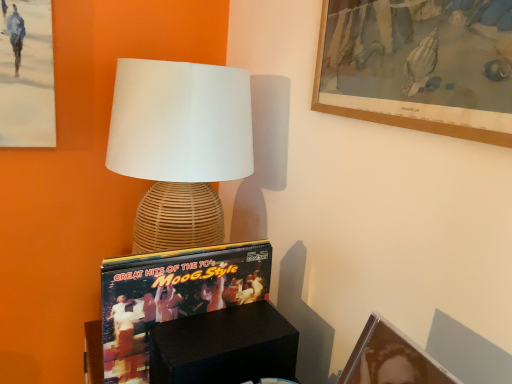
What do you see at coordinates (419, 65) in the screenshot?
I see `wooden picture frame at upper right, the 1th picture frame viewed from the top` at bounding box center [419, 65].

The height and width of the screenshot is (384, 512). I want to click on wooden picture frame at upper right, the 1th picture frame viewed from the top, so click(419, 65).

How much space does matte black picture frame at lower right, the second picture frame in the top-to-bottom sequence, occupy vertically?

5.65 inches.

At what (x,y) coordinates should I click in order to perform the action: click on black matte box at lower center. Please return your answer as a coordinate pair (x, y). The width and height of the screenshot is (512, 384). Looking at the image, I should click on (224, 347).

From a real-world perspective, is woven rattan lamp at center below black matte box at lower center?

Incorrect, from a real-world perspective, woven rattan lamp at center is higher than black matte box at lower center.

Can you confirm if woven rattan lamp at center is taller than black matte box at lower center?

Correct, woven rattan lamp at center is much taller as black matte box at lower center.

From the image's perspective, would you say woven rattan lamp at center is positioned over black matte box at lower center?

Yes, from the image's perspective, woven rattan lamp at center is on top of black matte box at lower center.

Is woven rattan lamp at center thinner than matte black picture frame at lower right, the 1th picture frame in the bottom-to-top sequence?

In fact, woven rattan lamp at center might be wider than matte black picture frame at lower right, the 1th picture frame in the bottom-to-top sequence.

Which is more to the right, woven rattan lamp at center or matte black picture frame at lower right, the second picture frame in the top-to-bottom sequence?

Positioned to the right is matte black picture frame at lower right, the second picture frame in the top-to-bottom sequence.

The width and height of the screenshot is (512, 384). I want to click on lamp lying on the left of matte black picture frame at lower right, the second picture frame in the top-to-bottom sequence, so click(x=180, y=146).

Which object is further away from the camera, woven rattan lamp at center or matte black picture frame at lower right, the second picture frame in the top-to-bottom sequence?

woven rattan lamp at center is behind.

From the image's perspective, is black matte box at lower center above or below matte black picture frame at lower right, the second picture frame in the top-to-bottom sequence?

black matte box at lower center is situated lower than matte black picture frame at lower right, the second picture frame in the top-to-bottom sequence, in the image.

Is black matte box at lower center looking in the opposite direction of matte black picture frame at lower right, the 1th picture frame in the bottom-to-top sequence?

black matte box at lower center is not turned away from matte black picture frame at lower right, the 1th picture frame in the bottom-to-top sequence.

Which is further, (197, 315) or (394, 352)?

Positioned behind is point (197, 315).

Identify the location of the 2nd picture frame in front of the black matte box at lower center. (391, 358).

From the image's perspective, is black matte box at lower center over woven rattan lamp at center?

No, from the image's perspective, black matte box at lower center is not over woven rattan lamp at center.

From the picture: Could woven rattan lamp at center be considered to be inside black matte box at lower center?

No.

Where is `furniture that is under the woven rattan lamp at center (from a real-world perspective)`? The image size is (512, 384). furniture that is under the woven rattan lamp at center (from a real-world perspective) is located at coordinates (224, 347).

Is black matte box at lower center not near woven rattan lamp at center?

black matte box at lower center is actually quite close to woven rattan lamp at center.

From the picture: Which is farther, [323,53] or [417,352]?

The point [323,53] is behind.

Consider the image. Is wooden picture frame at upper right, the 1th picture frame viewed from the top, shorter than matte black picture frame at lower right, the second picture frame in the top-to-bottom sequence?

In fact, wooden picture frame at upper right, the 1th picture frame viewed from the top, may be taller than matte black picture frame at lower right, the second picture frame in the top-to-bottom sequence.

Which of these two, wooden picture frame at upper right, which is the 2th picture frame from bottom to top, or matte black picture frame at lower right, the 1th picture frame in the bottom-to-top sequence, is smaller?

With smaller size is matte black picture frame at lower right, the 1th picture frame in the bottom-to-top sequence.

From a real-world perspective, which object stands above the other?

wooden picture frame at upper right, which is the 2th picture frame from bottom to top, from a real-world perspective.

Is point (187, 179) closer or farther from the camera than point (386, 7)?

Point (187, 179).

How different are the orientations of woven rattan lamp at center and wooden picture frame at upper right, which is the 2th picture frame from bottom to top, in degrees?

The facing directions of woven rattan lamp at center and wooden picture frame at upper right, which is the 2th picture frame from bottom to top, are 3.06 degrees apart.

Is woven rattan lamp at center surrounding wooden picture frame at upper right, the 1th picture frame viewed from the top?

No.

Between woven rattan lamp at center and wooden picture frame at upper right, the 1th picture frame viewed from the top, which one has smaller size?

wooden picture frame at upper right, the 1th picture frame viewed from the top, is smaller.

Is matte black picture frame at lower right, the 1th picture frame in the bottom-to-top sequence, looking in the opposite direction of black matte box at lower center?

matte black picture frame at lower right, the 1th picture frame in the bottom-to-top sequence, is not turned away from black matte box at lower center.

Considering the sizes of objects matte black picture frame at lower right, the second picture frame in the top-to-bottom sequence, and black matte box at lower center in the image provided, who is wider, matte black picture frame at lower right, the second picture frame in the top-to-bottom sequence, or black matte box at lower center?

black matte box at lower center.

Looking at this image, can you confirm if matte black picture frame at lower right, the second picture frame in the top-to-bottom sequence, is shorter than black matte box at lower center?

Indeed, matte black picture frame at lower right, the second picture frame in the top-to-bottom sequence, has a lesser height compared to black matte box at lower center.

Measure the distance between matte black picture frame at lower right, the 1th picture frame in the bottom-to-top sequence, and black matte box at lower center.

They are 10.19 inches apart.

Find the location of a particular element. The image size is (512, 384). lamp above the black matte box at lower center (from the image's perspective) is located at coordinates click(x=180, y=146).

You are a GUI agent. You are given a task and a screenshot of the screen. Output one action in this format:
    pyautogui.click(x=<x>, y=<y>)
    Task: Click on the picture frame below the woven rattan lamp at center (from a real-world perspective)
    Image resolution: width=512 pixels, height=384 pixels.
    Given the screenshot: What is the action you would take?
    pyautogui.click(x=391, y=358)

Which object lies nearer to the anchor point woven rattan lamp at center, matte black picture frame at lower right, the second picture frame in the top-to-bottom sequence, or wooden picture frame at upper right, the 1th picture frame viewed from the top?

wooden picture frame at upper right, the 1th picture frame viewed from the top, lies closer to woven rattan lamp at center than the other object.

Looking at the image, which one is located further to black matte box at lower center, woven rattan lamp at center or matte black picture frame at lower right, the second picture frame in the top-to-bottom sequence?

woven rattan lamp at center is positioned further to the anchor black matte box at lower center.

Which object lies nearer to the anchor point matte black picture frame at lower right, the second picture frame in the top-to-bottom sequence, woven rattan lamp at center or wooden picture frame at upper right, the 1th picture frame viewed from the top?

The object closer to matte black picture frame at lower right, the second picture frame in the top-to-bottom sequence, is wooden picture frame at upper right, the 1th picture frame viewed from the top.

Which object lies nearer to the anchor point black matte box at lower center, woven rattan lamp at center or wooden picture frame at upper right, which is the 2th picture frame from bottom to top?

woven rattan lamp at center.

Considering their positions, is wooden picture frame at upper right, which is the 2th picture frame from bottom to top, positioned closer to matte black picture frame at lower right, the 1th picture frame in the bottom-to-top sequence, than woven rattan lamp at center?

wooden picture frame at upper right, which is the 2th picture frame from bottom to top.

When comparing their distances from matte black picture frame at lower right, the second picture frame in the top-to-bottom sequence, does black matte box at lower center or woven rattan lamp at center seem further?

The object further to matte black picture frame at lower right, the second picture frame in the top-to-bottom sequence, is woven rattan lamp at center.

From the image, which object appears to be nearer to wooden picture frame at upper right, the 1th picture frame viewed from the top, black matte box at lower center or woven rattan lamp at center?

The object closer to wooden picture frame at upper right, the 1th picture frame viewed from the top, is woven rattan lamp at center.

Which object lies further to the anchor point woven rattan lamp at center, wooden picture frame at upper right, the 1th picture frame viewed from the top, or matte black picture frame at lower right, the 1th picture frame in the bottom-to-top sequence?

Among the two, matte black picture frame at lower right, the 1th picture frame in the bottom-to-top sequence, is located further to woven rattan lamp at center.

Locate an element on the screen. The width and height of the screenshot is (512, 384). picture frame between woven rattan lamp at center and black matte box at lower center vertically is located at coordinates (391, 358).

This screenshot has height=384, width=512. What are the coordinates of `picture frame that lies between wooden picture frame at upper right, the 1th picture frame viewed from the top, and black matte box at lower center from top to bottom` in the screenshot? It's located at (391, 358).

I want to click on lamp between wooden picture frame at upper right, the 1th picture frame viewed from the top, and black matte box at lower center, in the vertical direction, so click(180, 146).

The height and width of the screenshot is (384, 512). Find the location of `lamp between wooden picture frame at upper right, which is the 2th picture frame from bottom to top, and matte black picture frame at lower right, the 1th picture frame in the bottom-to-top sequence, from top to bottom`. lamp between wooden picture frame at upper right, which is the 2th picture frame from bottom to top, and matte black picture frame at lower right, the 1th picture frame in the bottom-to-top sequence, from top to bottom is located at coordinates (180, 146).